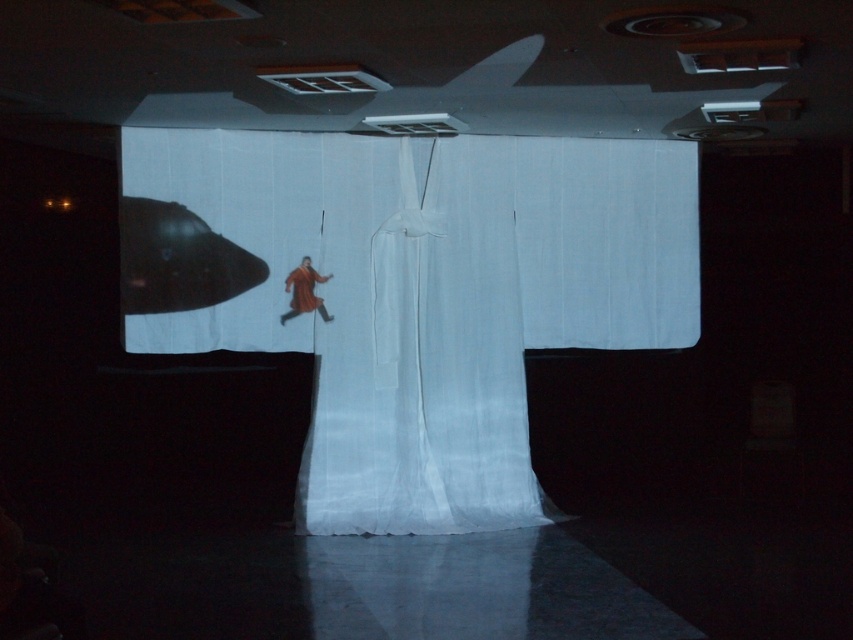
Who is higher up, white sheer curtain at center or red velvet kimono at center?

red velvet kimono at center

Does white sheer curtain at center lie behind red velvet kimono at center?

That is False.

What do you see at coordinates (428, 296) in the screenshot? I see `white sheer curtain at center` at bounding box center [428, 296].

At what (x,y) coordinates should I click in order to perform the action: click on white sheer curtain at center. Please return your answer as a coordinate pair (x, y). Image resolution: width=853 pixels, height=640 pixels. Looking at the image, I should click on (428, 296).